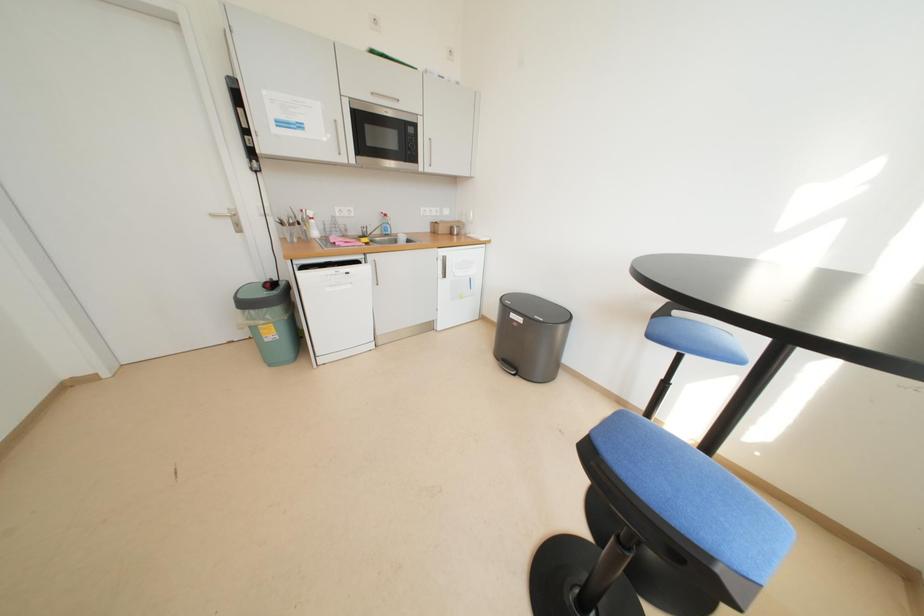
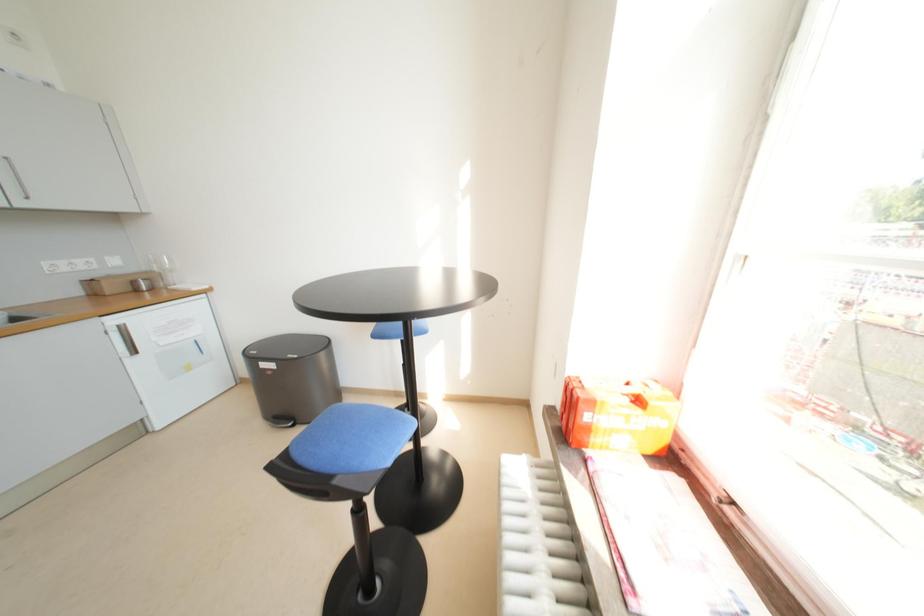
Question: Based on the continuous images, in which direction is the camera rotating? Reply with the corresponding letter.

Choices:
 (A) Left
 (B) Right
 (C) Up
 (D) Down

Answer: (B)